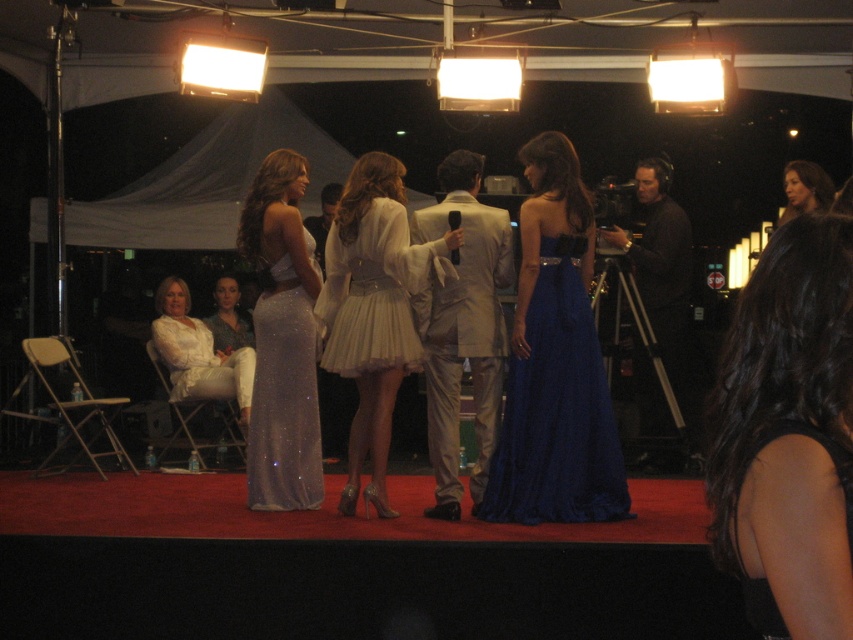
Is point (549, 268) farther from camera compared to point (196, 372)?

No.

Between blue satin gown at center and white satin dress at left, which one is positioned lower?

blue satin gown at center is lower down.

I want to click on blue satin gown at center, so click(556, 408).

Identify the location of blue satin gown at center. (556, 408).

Is point (456, 392) in front of point (677, 424)?

Yes, it is.

Is satin beige suit at center to the left of black matte camera at right from the viewer's perspective?

Indeed, satin beige suit at center is positioned on the left side of black matte camera at right.

Who is more distant from viewer, (x=457, y=397) or (x=648, y=186)?

Point (x=648, y=186)

Identify the location of satin beige suit at center. The image size is (853, 640). 462,326.

Is point (764, 509) positioned before point (643, 276)?

Yes, point (764, 509) is in front of point (643, 276).

Is point (799, 465) behind point (671, 209)?

No, (799, 465) is closer to viewer.

Where is `black satin dress at center`? black satin dress at center is located at coordinates (788, 435).